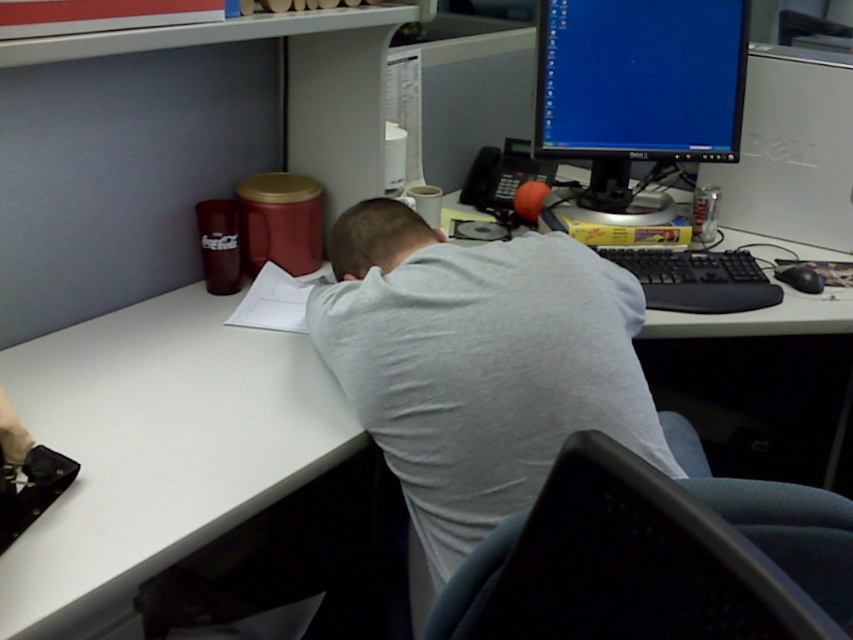
From the picture: You are standing in the office cubicle and need to determine which of the two points, point (x=67, y=563) or point (x=375, y=275), is closer to you. Based on the scene description, which point is nearer?

Point (x=67, y=563) is closer to the viewer than point (x=375, y=275).

You are an office assistant who needs to deliver a message to the person wearing the gray cotton shirt at center. You are currently standing in front of the black glossy monitor at upper right. Which direction should you move to reach the person?

The gray cotton shirt at center is to the left of the black glossy monitor at upper right, so you should move to the left to reach the person.